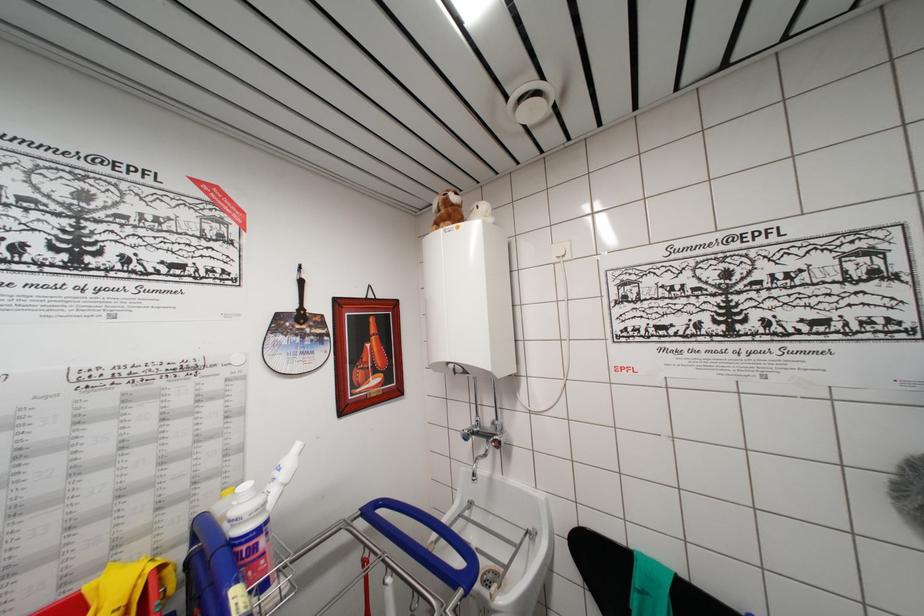
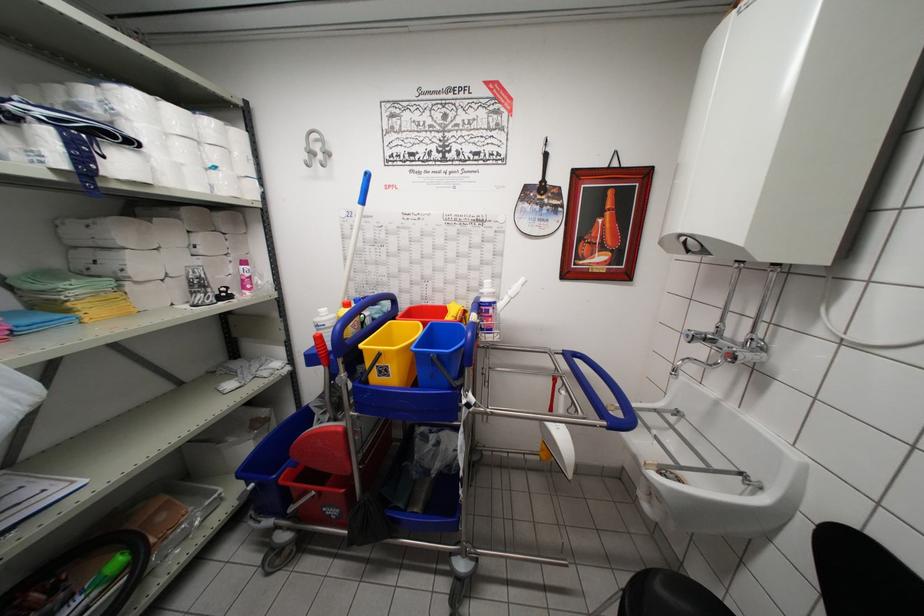
The first image is from the beginning of the video and the second image is from the end. How did the camera likely rotate when shooting the video?

The rotation direction of the camera is left-down.